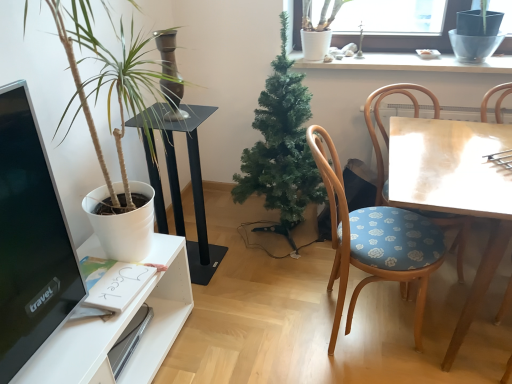
Locate an element on the screen. free area in between black glass table at center and wooden chair with blue floral cushion at right, arranged as the second chair when viewed from the right is located at coordinates (263, 294).